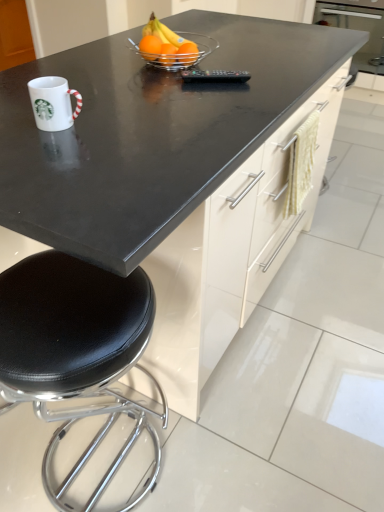
This screenshot has height=512, width=384. Identify the location of vacant area that lies between white glossy mug at left and orange matte at center, acting as the 2th orange starting from the left. click(122, 94).